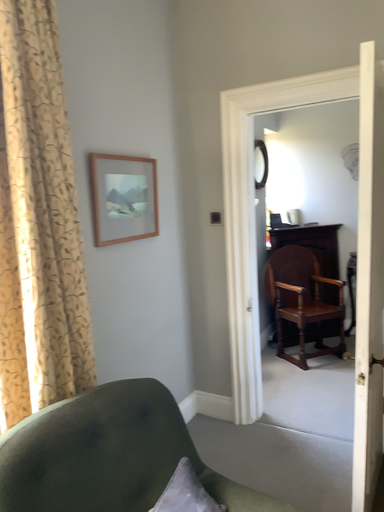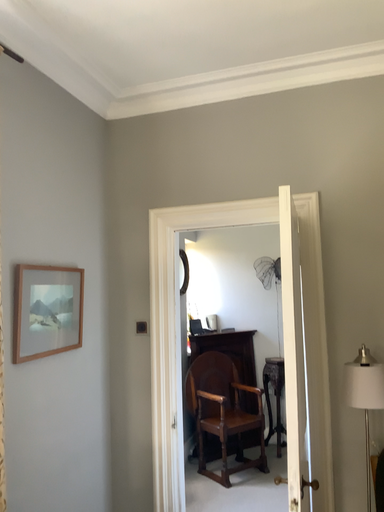
Question: How did the camera likely rotate when shooting the video?

Choices:
 (A) rotated upward
 (B) rotated downward

Answer: (A)